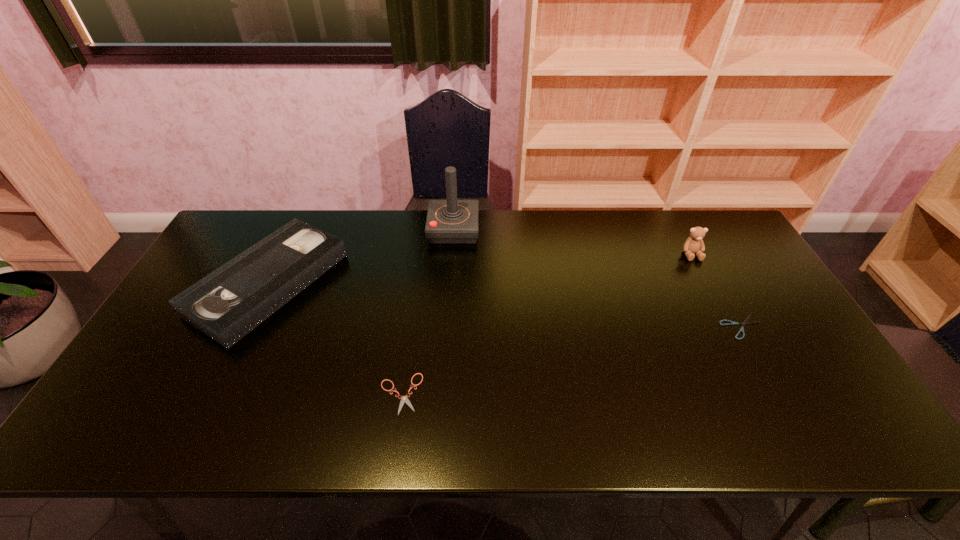
At what (x,y) coordinates should I click in order to perform the action: click on object that is positioned at the far right corner. Please return your answer as a coordinate pair (x, y). Looking at the image, I should click on (694, 244).

In the image, there is a desktop. At what (x,y) coordinates should I click in order to perform the action: click on blank space at the far edge. Please return your answer as a coordinate pair (x, y). The width and height of the screenshot is (960, 540). Looking at the image, I should click on (373, 222).

You are a GUI agent. You are given a task and a screenshot of the screen. Output one action in this format:
    pyautogui.click(x=<x>, y=<y>)
    Task: Click on the vacant region at the near edge of the desktop
    Image resolution: width=960 pixels, height=540 pixels.
    Given the screenshot: What is the action you would take?
    pyautogui.click(x=521, y=422)

What are the coordinates of `free space at the left edge` in the screenshot? It's located at (168, 333).

Find the location of a particular element. The image size is (960, 540). free location at the near left corner is located at coordinates (153, 420).

In the image, there is a desktop. Where is `blank space at the near right corner`? blank space at the near right corner is located at coordinates (836, 445).

Locate an element on the screen. vacant space in between the leftmost object and the fourth shortest object is located at coordinates (480, 269).

Locate an element on the screen. Image resolution: width=960 pixels, height=540 pixels. vacant space in between the teddy bear and the joystick is located at coordinates (572, 242).

Locate an element on the screen. blank region between the joystick and the right shears is located at coordinates (598, 278).

The height and width of the screenshot is (540, 960). In order to click on empty space between the farther shears and the third tallest object in this screenshot , I will do `click(505, 305)`.